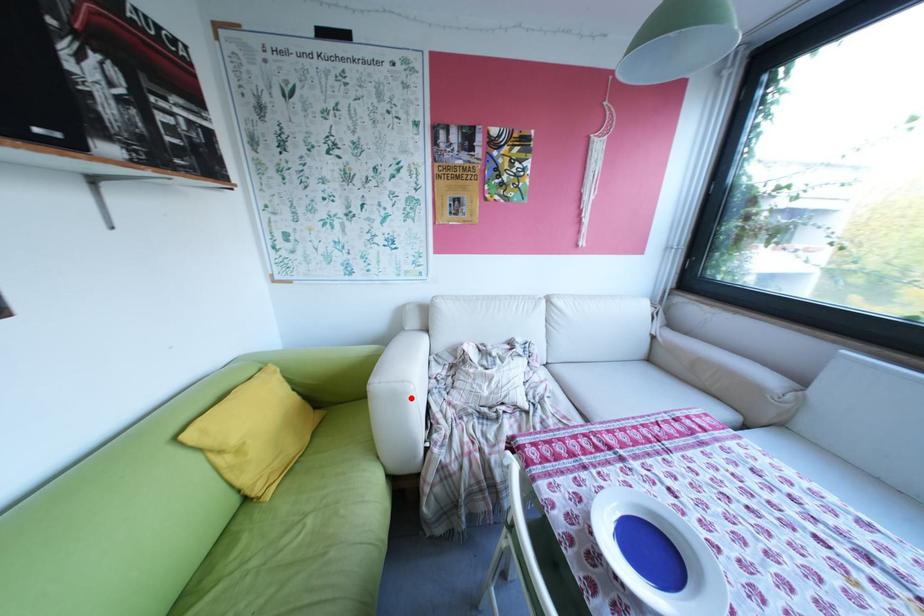
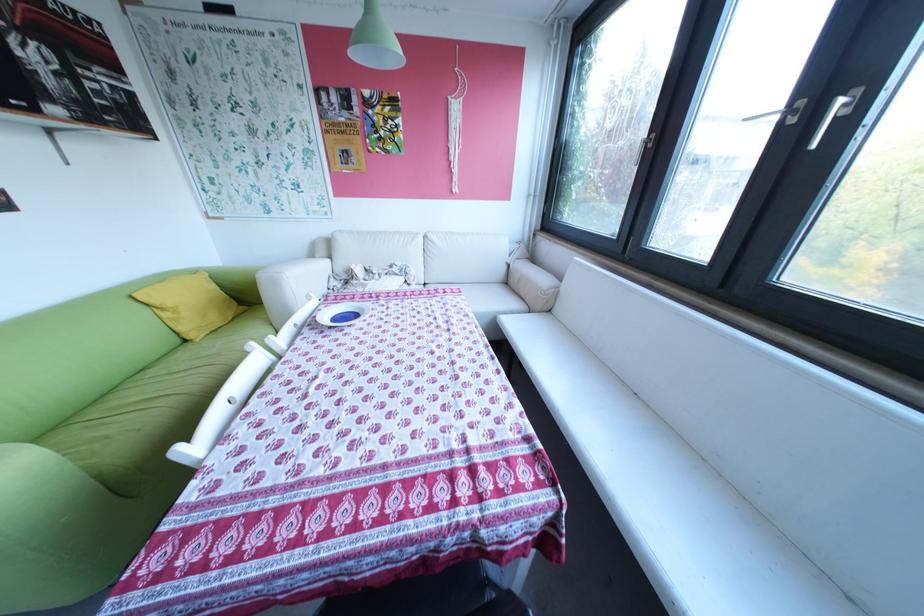
Where in the second image is the point corresponding to the highlighted location from the first image?

(288, 283)